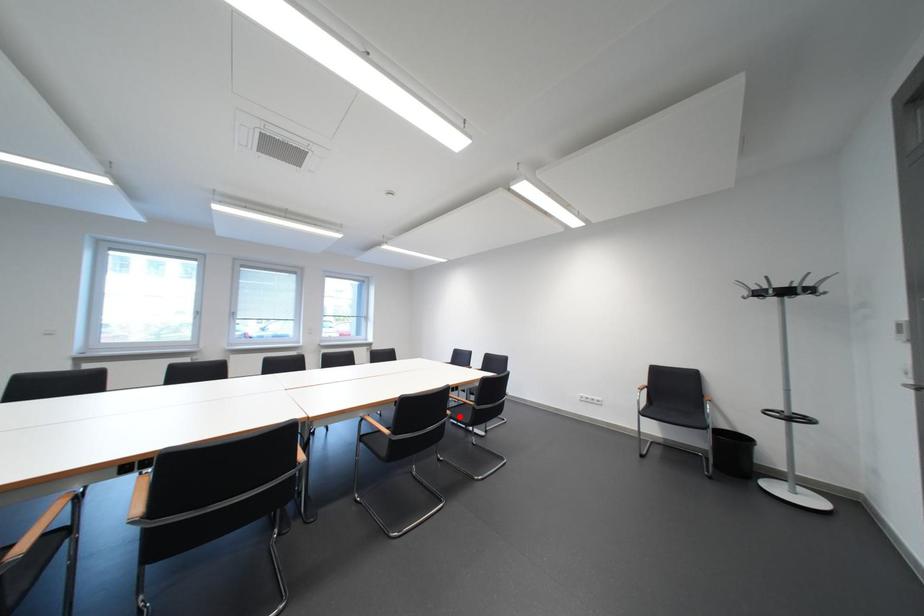
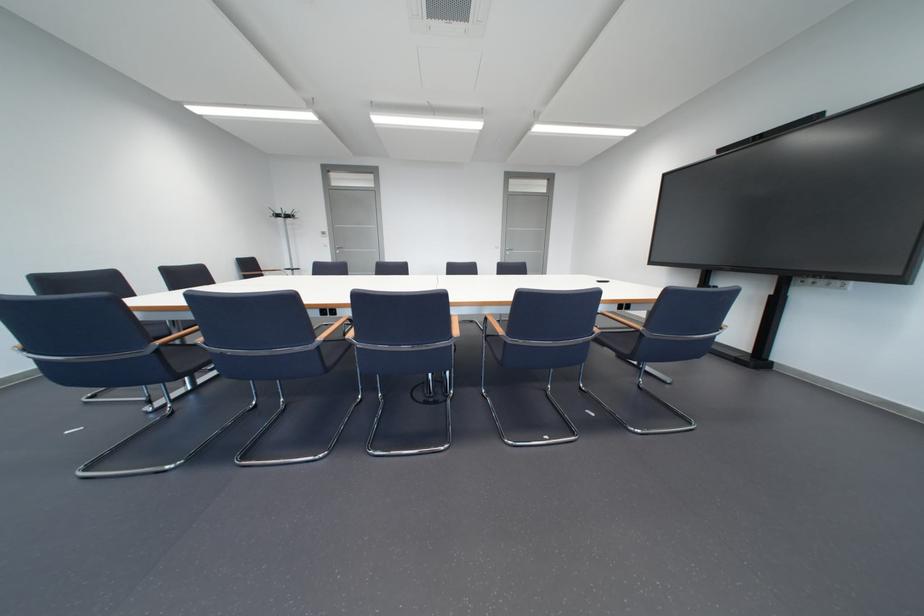
Question: I am providing you with two images of the same scene from different viewpoints. A red point is marked on the first image. At the location where the point appears in image 1, is it still visible in image 2?

Choices:
 (A) Yes
 (B) No

Answer: (B)